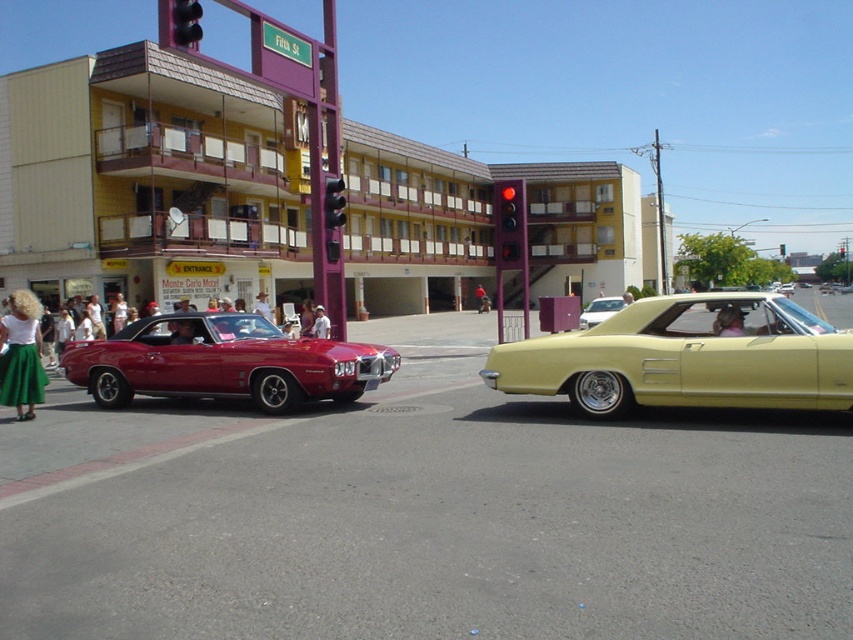
From the picture: You are driving a car and see the red glass traffic light at center and the metallic gold car at center. Which object is positioned to the left?

The red glass traffic light at center is to the left of the metallic gold car at center.

You are a pedestrian standing at the crosswalk and see the matte red car at left and the metallic traffic light at center. Which object is closer to your left side?

The matte red car at left is closer to your left side because it is positioned to the left of the metallic traffic light at center.